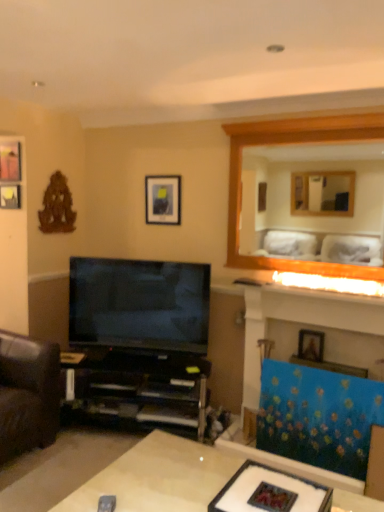
The height and width of the screenshot is (512, 384). I want to click on free space underneath matte black tv at center (from a real-world perspective), so click(x=130, y=362).